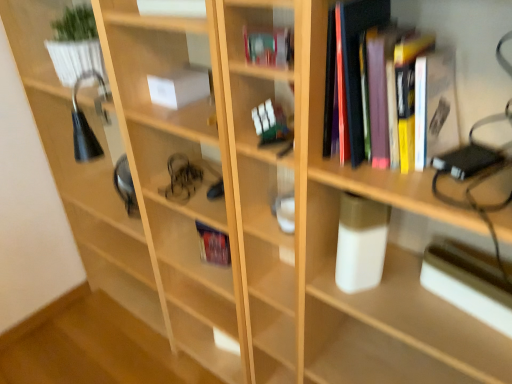
I want to click on free space above metallic silver paperback book at right (from a real-world perspective), so click(475, 266).